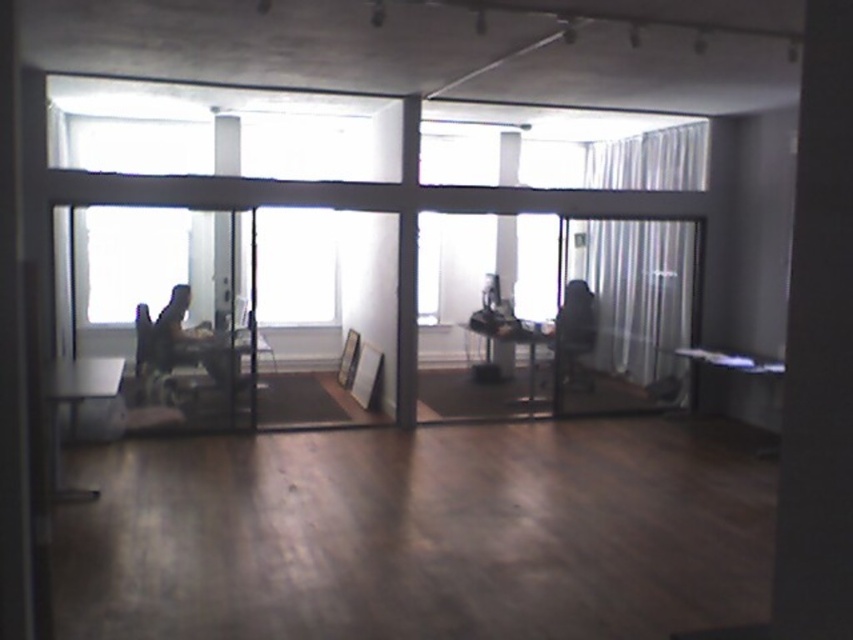
Question: Which point is farther to the camera?

Choices:
 (A) [561, 355]
 (B) [334, 272]

Answer: (B)

Question: Which of these objects is positioned farthest from the dark gray fabric chair at left?

Choices:
 (A) transparent glass window at center
 (B) black fabric chair at center

Answer: (B)

Question: Considering the relative positions of transparent glass window at center and dark gray fabric chair at left in the image provided, where is transparent glass window at center located with respect to dark gray fabric chair at left?

Choices:
 (A) left
 (B) right

Answer: (B)

Question: Which of the following is the closest to the observer?

Choices:
 (A) coord(296,227)
 (B) coord(566,356)

Answer: (B)

Question: In this image, where is transparent glass window at center located relative to black fabric chair at center?

Choices:
 (A) right
 (B) left

Answer: (B)

Question: Can you confirm if dark gray fabric chair at left is positioned above black fabric chair at center?

Choices:
 (A) no
 (B) yes

Answer: (A)